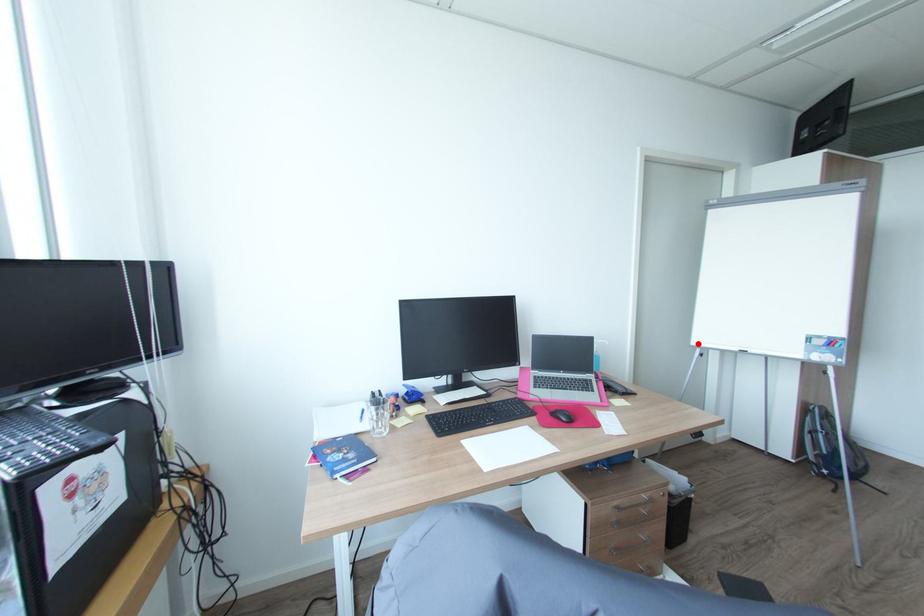
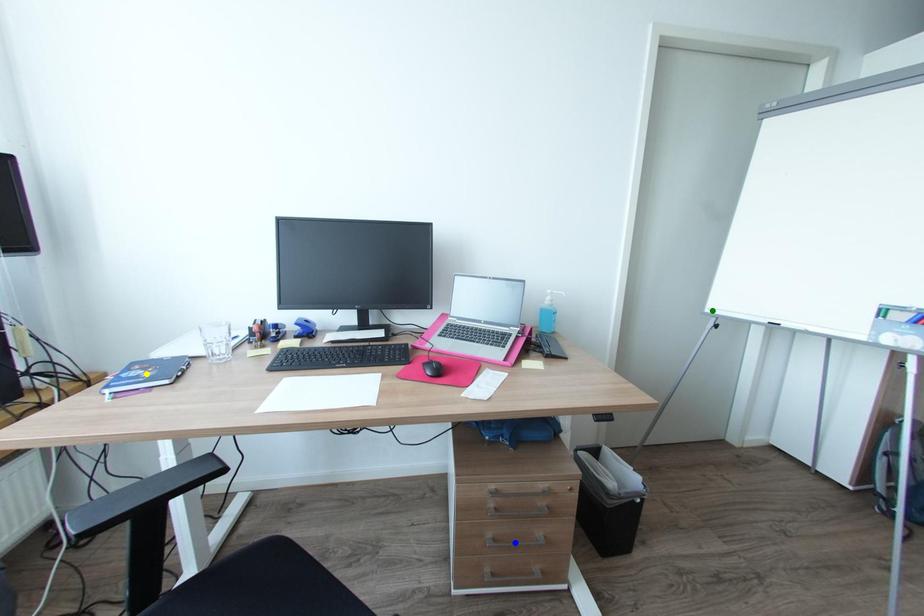
Question: I am providing you with two images of the same scene from different viewpoints. A red point is marked on the first image. You are given multiple points on the second image. Which point in image 2 is actually the same real-world point as the red point in image 1?

Choices:
 (A) blue point
 (B) green point
 (C) yellow point

Answer: (B)